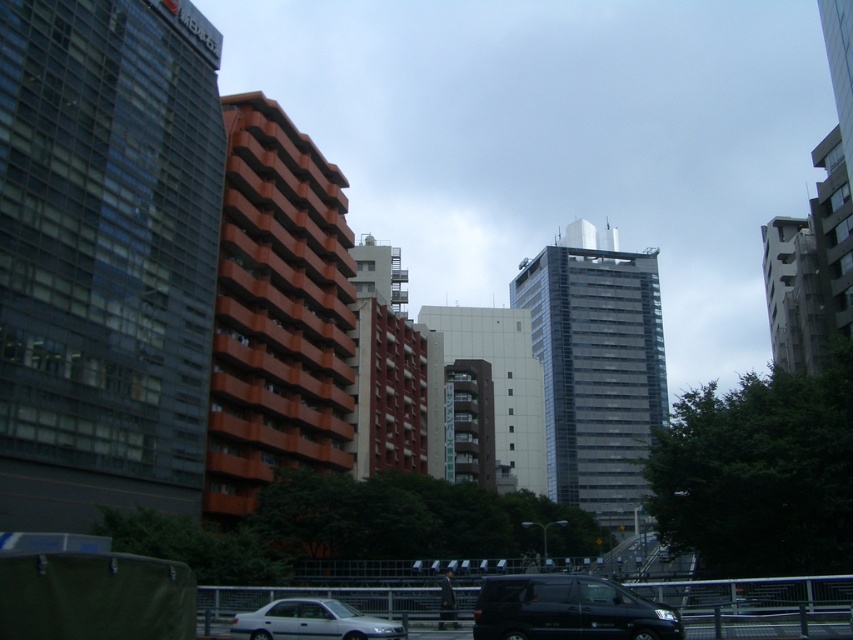
Which is in front, point (614, 612) or point (347, 616)?

Point (614, 612)

Can you confirm if black matte van at lower center is positioned above silver metallic car at center?

Yes.

Does point (639, 611) lie in front of point (370, 621)?

Yes, point (639, 611) is in front of point (370, 621).

The height and width of the screenshot is (640, 853). Find the location of `black matte van at lower center`. black matte van at lower center is located at coordinates (567, 609).